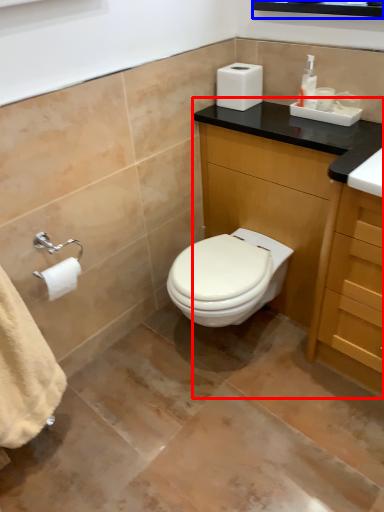
Question: Which object appears closest to the camera in this image, bathroom cabinet (highlighted by a red box) or medicine cabinet (highlighted by a blue box)?

Choices:
 (A) bathroom cabinet
 (B) medicine cabinet

Answer: (B)